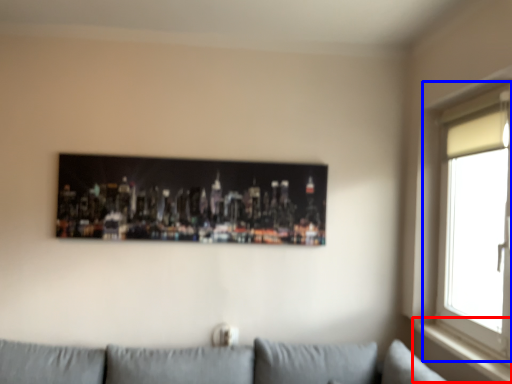
Question: Which object appears closest to the camera in this image, window sill (highlighted by a red box) or window (highlighted by a blue box)?

Choices:
 (A) window sill
 (B) window

Answer: (B)